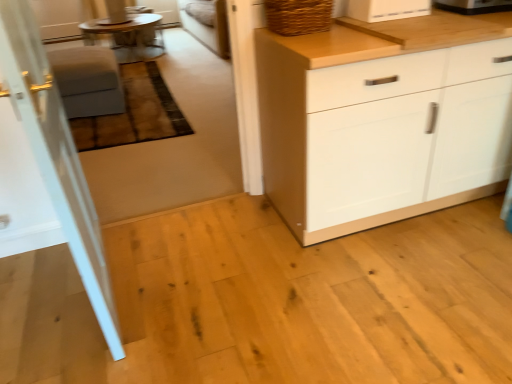
Where is `vacant area that is in front of white matte cabinet at center`? The image size is (512, 384). vacant area that is in front of white matte cabinet at center is located at coordinates (417, 280).